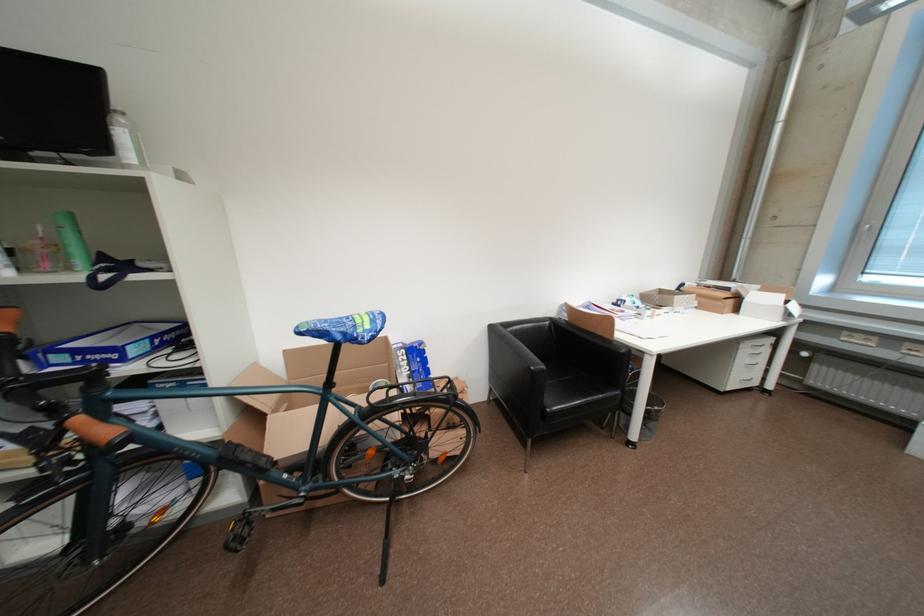
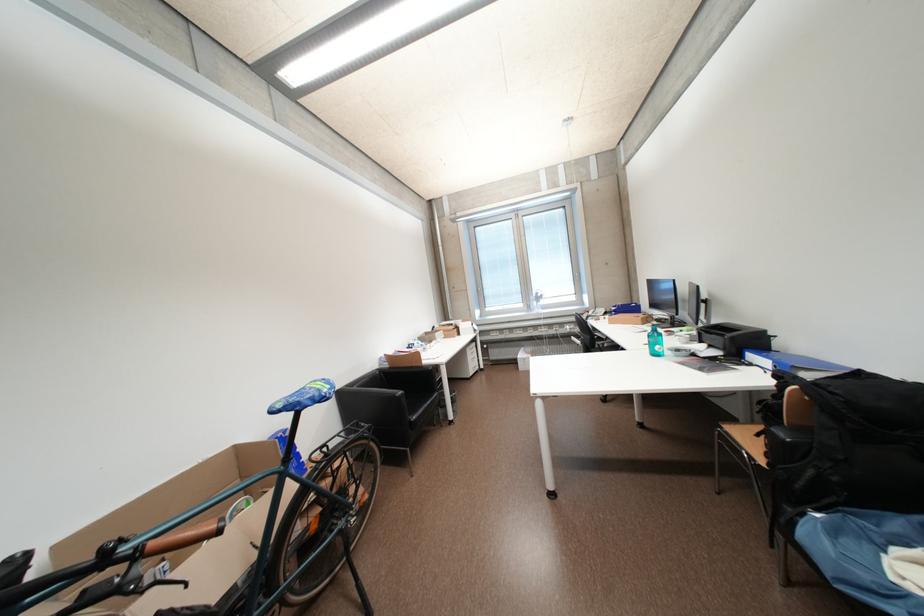
Where in the second image is the point corresponding to point 359,336 from the first image?

(329, 398)